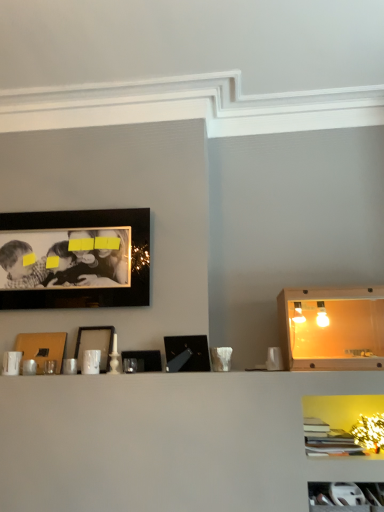
Question: Is wooden cabinet at right, arranged as the 1th cabinet when viewed from the back, located outside black glossy picture frame at center, the 1th picture frame from the right?

Choices:
 (A) yes
 (B) no

Answer: (A)

Question: Is wooden cabinet at right, arranged as the 1th cabinet when viewed from the back, taller than black glossy picture frame at center, which ranks as the 5th picture frame in left-to-right order?

Choices:
 (A) no
 (B) yes

Answer: (B)

Question: Is wooden cabinet at right, the second cabinet viewed from the front, smaller than black glossy picture frame at center, the 1th picture frame from the right?

Choices:
 (A) yes
 (B) no

Answer: (B)

Question: From the image's perspective, is wooden cabinet at right, which is the 1th cabinet in top-to-bottom order, beneath black glossy picture frame at center, which ranks as the 5th picture frame in left-to-right order?

Choices:
 (A) yes
 (B) no

Answer: (B)

Question: Is wooden cabinet at right, the second cabinet positioned from the bottom, oriented away from black glossy picture frame at center, the 1th picture frame from the right?

Choices:
 (A) no
 (B) yes

Answer: (A)

Question: Does wooden cabinet at right, which is the 1th cabinet in top-to-bottom order, have a lesser width compared to black glossy picture frame at center, the 1th picture frame from the right?

Choices:
 (A) no
 (B) yes

Answer: (A)

Question: Can you confirm if matte black picture frame at center, arranged as the third picture frame when viewed from the left, is thinner than black matte picture frame at center, which is the 4th picture frame from left to right?

Choices:
 (A) yes
 (B) no

Answer: (B)

Question: From a real-world perspective, is matte black picture frame at center, arranged as the third picture frame when viewed from the left, positioned over black matte picture frame at center, which is counted as the 2th picture frame, starting from the right, based on gravity?

Choices:
 (A) yes
 (B) no

Answer: (A)

Question: Is matte black picture frame at center, arranged as the third picture frame when viewed from the left, surrounding black matte picture frame at center, which is counted as the 2th picture frame, starting from the right?

Choices:
 (A) yes
 (B) no

Answer: (B)

Question: Can you confirm if matte black picture frame at center, arranged as the third picture frame when viewed from the left, is positioned to the right of black matte picture frame at center, which is the 4th picture frame from left to right?

Choices:
 (A) no
 (B) yes

Answer: (A)

Question: Does matte black picture frame at center, which is the third picture frame in right-to-left order, come in front of black matte picture frame at center, which is the 4th picture frame from left to right?

Choices:
 (A) yes
 (B) no

Answer: (B)

Question: Considering the relative sizes of matte black picture frame at center, arranged as the third picture frame when viewed from the left, and black matte picture frame at center, which is the 4th picture frame from left to right, in the image provided, is matte black picture frame at center, arranged as the third picture frame when viewed from the left, taller than black matte picture frame at center, which is the 4th picture frame from left to right,?

Choices:
 (A) yes
 (B) no

Answer: (A)

Question: Does matte brown picture frame at center-left, the first picture frame from the left, come behind black matte picture frame at center, which is counted as the 2th picture frame, starting from the right?

Choices:
 (A) no
 (B) yes

Answer: (B)